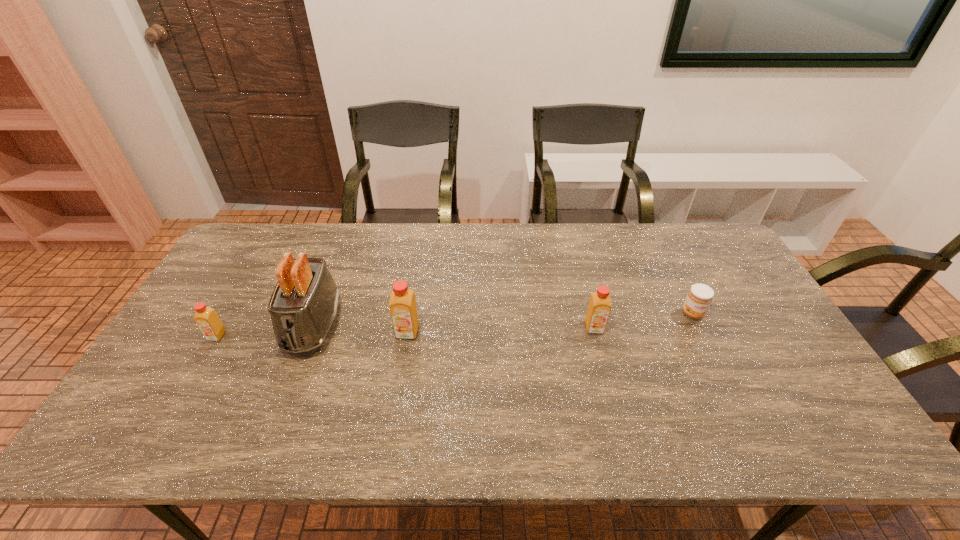
Observe the arrangement of all orange juices in the image. To keep them evenly spaced, where would you place another orange juice on the right? Please locate a free space. Please provide its 2D coordinates. Your answer should be formatted as a tuple, i.e. [(x, y)], where the tuple contains the x and y coordinates of a point satisfying the conditions above.

[(778, 324)]